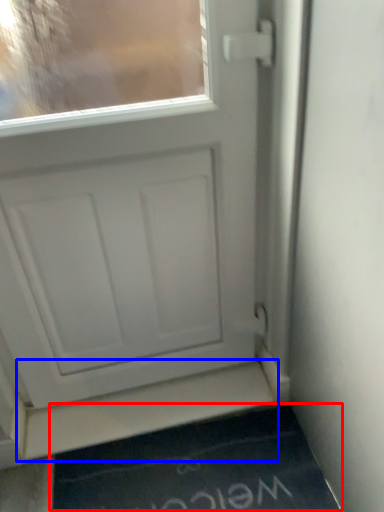
Question: Which object is closer to the camera taking this photo, doormat (highlighted by a red box) or stairwell (highlighted by a blue box)?

Choices:
 (A) doormat
 (B) stairwell

Answer: (A)